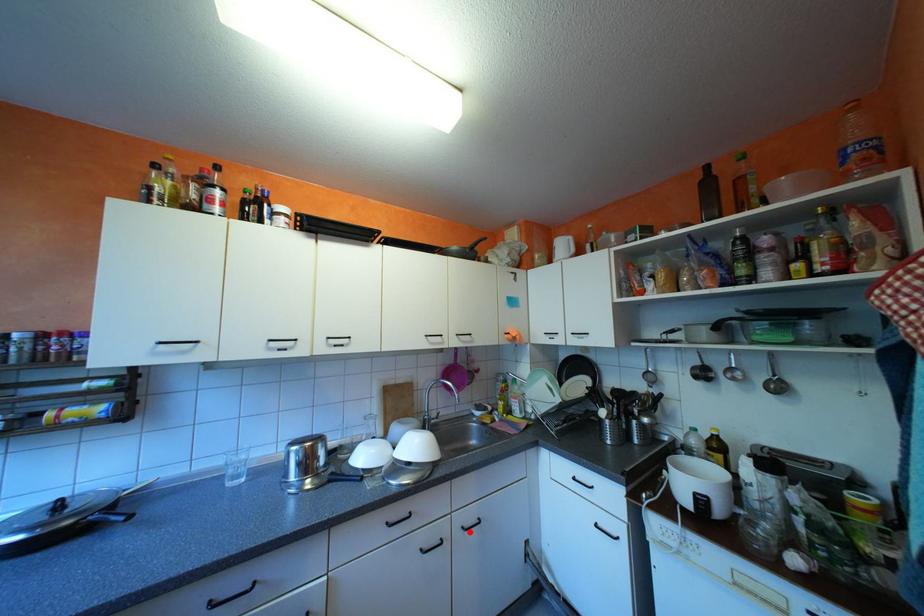
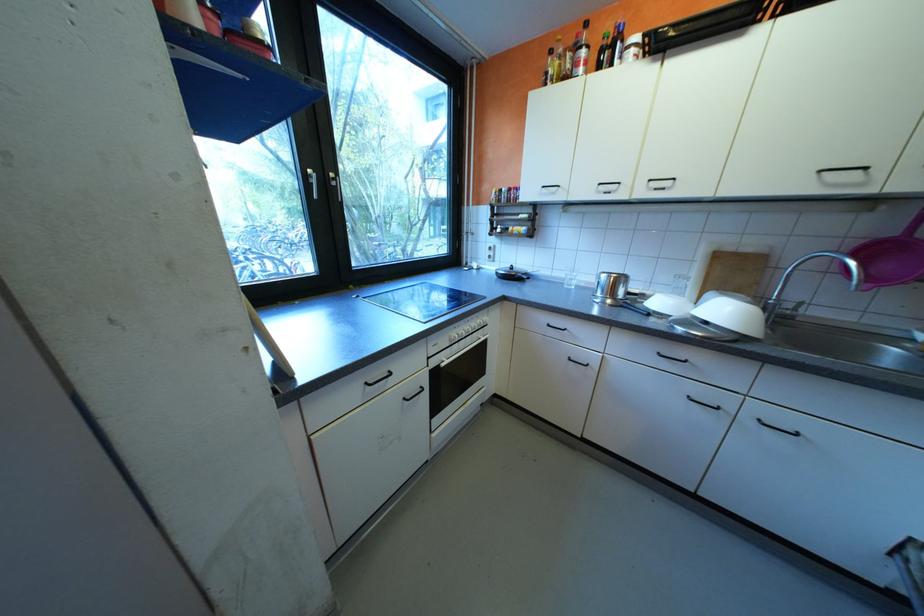
Locate, in the second image, the point that corresponds to the highlighted location in the first image.

(760, 419)